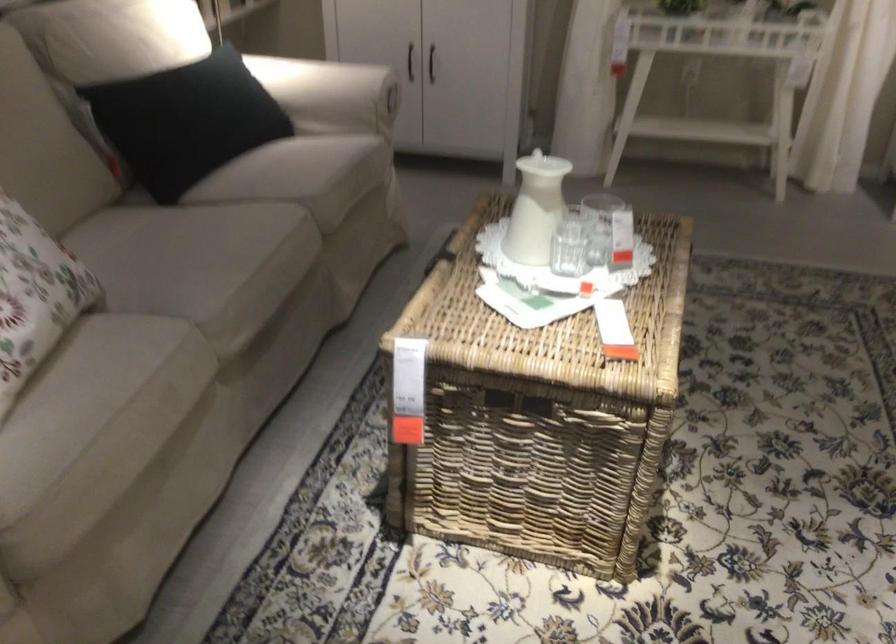
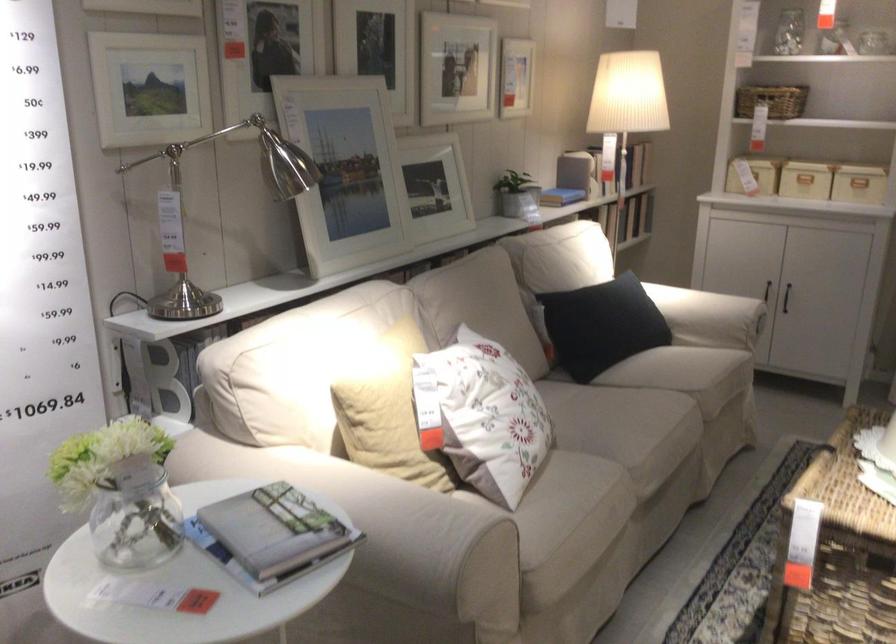
Where in the second image is the point corresponding to pixel 322 108 from the first image?

(709, 317)